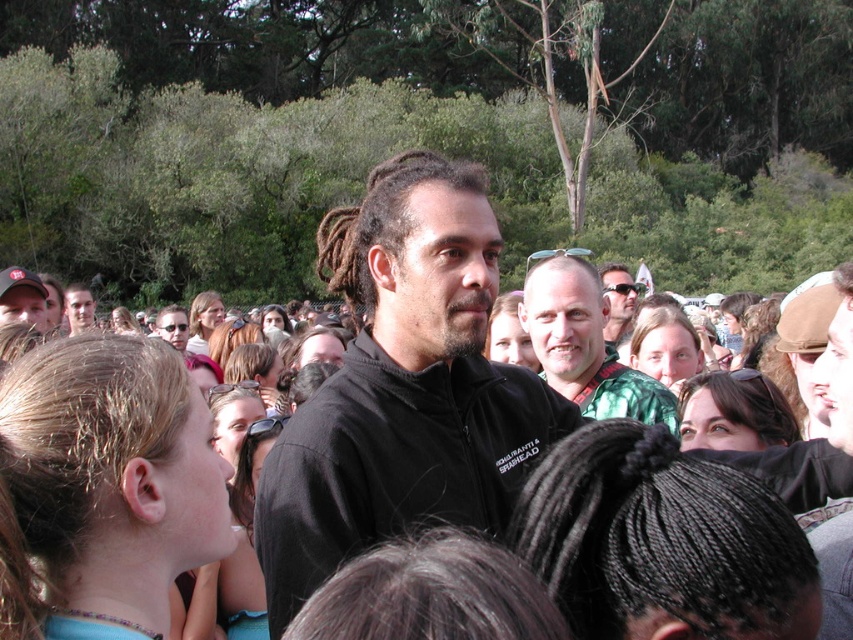
Question: Which object is positioned farthest from the matte black cap at upper left?

Choices:
 (A) green textured shirt at center
 (B) matte black sunglasses at center
 (C) matte black jacket at center
 (D) black matte jacket at center

Answer: (B)

Question: Which of these objects is positioned closest to the green textured shirt at center?

Choices:
 (A) matte black jacket at center
 (B) matte black cap at upper left
 (C) black matte jacket at center

Answer: (C)

Question: Is matte black cap at upper left wider than matte black jacket at center?

Choices:
 (A) yes
 (B) no

Answer: (B)

Question: Which point is closer to the camera taking this photo?

Choices:
 (A) (13, 273)
 (B) (340, 433)
 (C) (628, 310)
 (D) (91, 320)

Answer: (B)

Question: Can you confirm if green textured shirt at center is positioned to the left of matte black sunglasses at center?

Choices:
 (A) no
 (B) yes

Answer: (B)

Question: Does black matte jacket at center appear on the right side of matte black jacket at center?

Choices:
 (A) no
 (B) yes

Answer: (B)